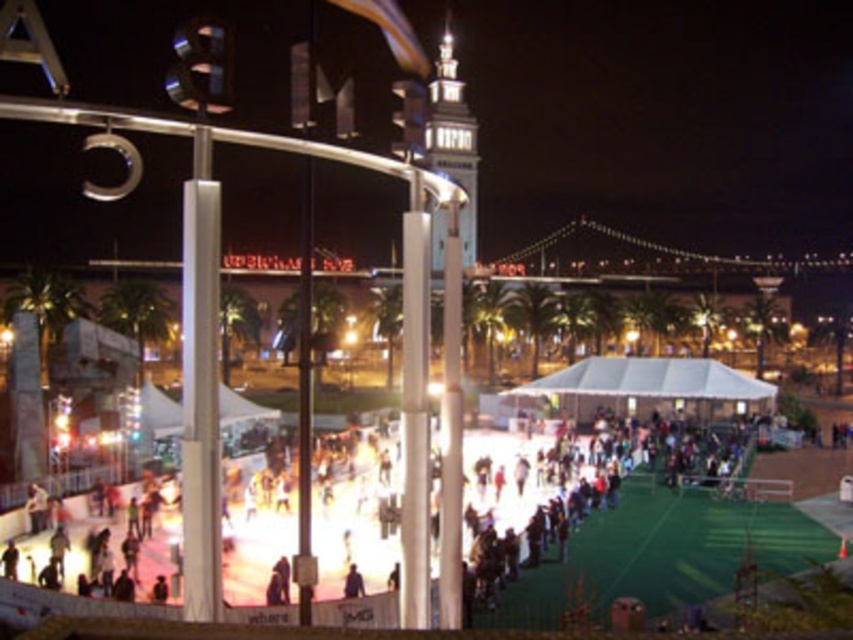
Can you confirm if dark clothing at center is smaller than white glossy tower at center?

Yes.

Is dark clothing at center bigger than white glossy tower at center?

Incorrect, dark clothing at center is not larger than white glossy tower at center.

At what (x,y) coordinates should I click in order to perform the action: click on dark clothing at center. Please return your answer as a coordinate pair (x, y). The height and width of the screenshot is (640, 853). Looking at the image, I should click on (583, 500).